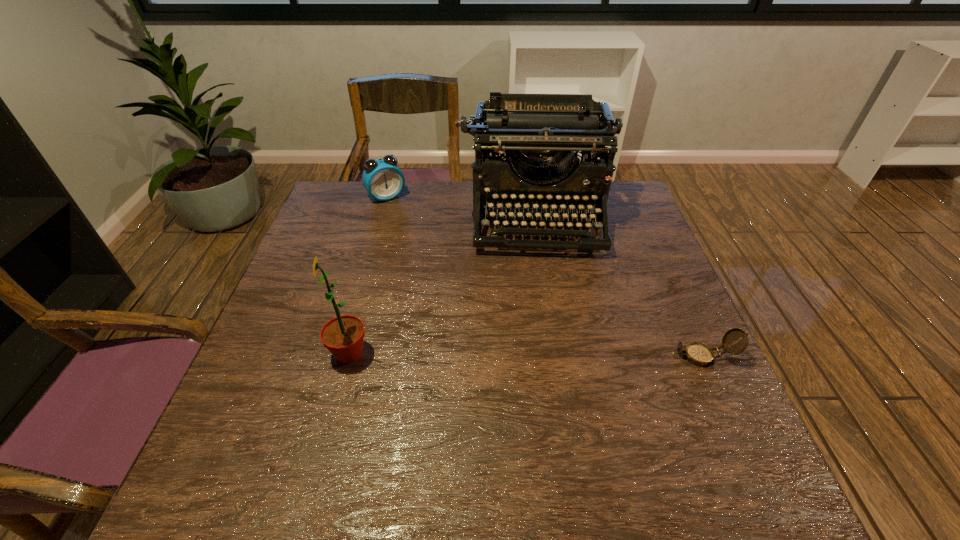
This screenshot has width=960, height=540. Find the location of `typewriter located in the right edge section of the desktop`. typewriter located in the right edge section of the desktop is located at coordinates (519, 127).

Where is `object present at the far left corner`? This screenshot has height=540, width=960. object present at the far left corner is located at coordinates (382, 178).

Locate an element on the screen. The width and height of the screenshot is (960, 540). object that is at the far right corner is located at coordinates (519, 127).

In order to click on free space at the far edge of the desktop in this screenshot , I will do `click(415, 209)`.

Image resolution: width=960 pixels, height=540 pixels. What are the coordinates of `vacant space at the near edge` in the screenshot? It's located at (441, 422).

Image resolution: width=960 pixels, height=540 pixels. Find the location of `vacant region at the left edge of the desktop`. vacant region at the left edge of the desktop is located at coordinates (297, 278).

You are a GUI agent. You are given a task and a screenshot of the screen. Output one action in this format:
    pyautogui.click(x=<x>, y=<y>)
    Task: Click on the free space at the right edge of the desktop
    The image size is (960, 540).
    Given the screenshot: What is the action you would take?
    pyautogui.click(x=645, y=253)

The image size is (960, 540). In order to click on unoccupied position between the compass and the sunflower in this screenshot , I will do click(x=526, y=355).

Identify the location of free spot between the typewriter and the shortest object. (620, 286).

Locate an element on the screen. The width and height of the screenshot is (960, 540). free space between the second shortest object and the shortest object is located at coordinates (544, 276).